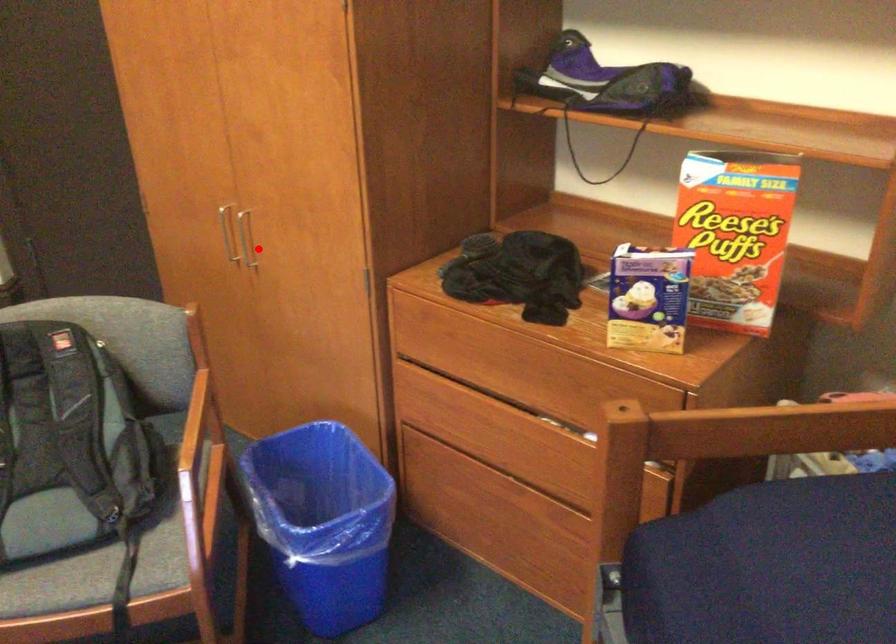
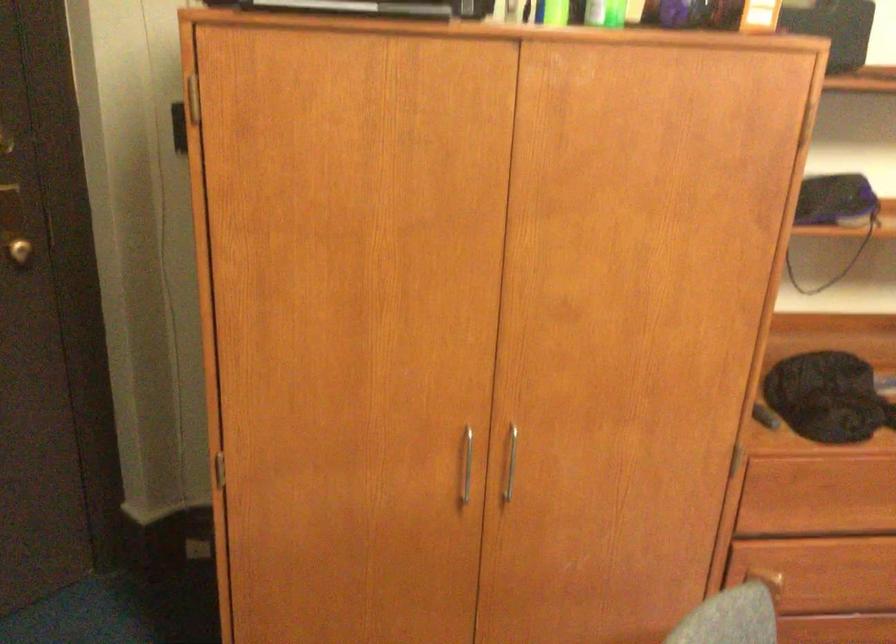
Question: I am providing you with two images of the same scene from different viewpoints. Image1 has a red point marked. In image2, the corresponding 3D location appears at what relative position? Reply with the corresponding letter.

Choices:
 (A) Closer
 (B) Farther

Answer: (A)